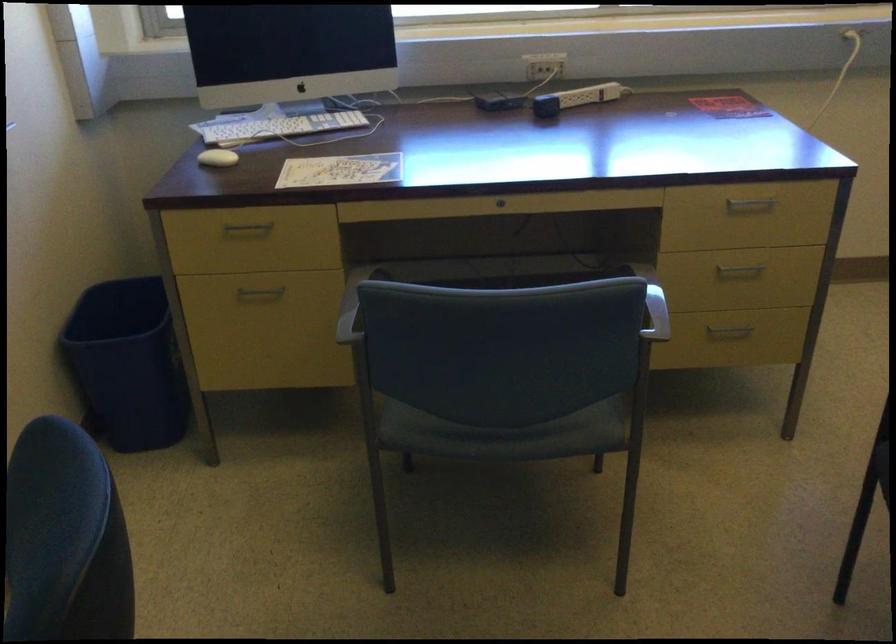
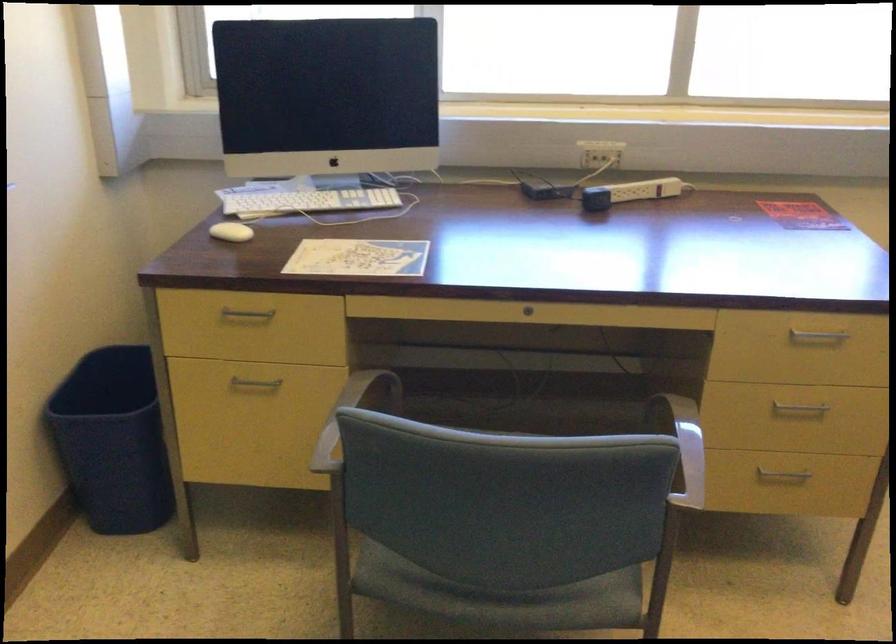
Where in the second image is the point corresponding to pixel 126 363 from the first image?

(113, 440)